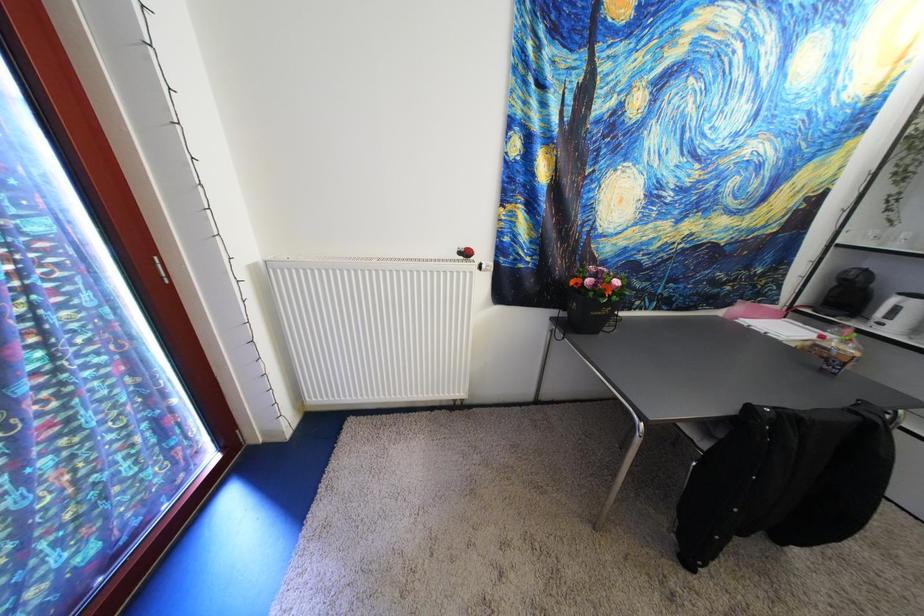
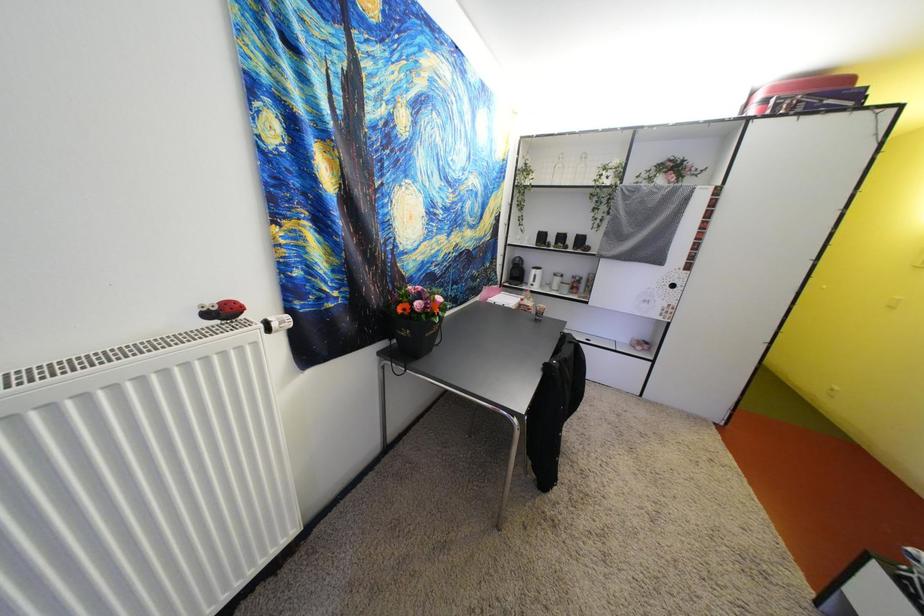
Question: The camera is either moving clockwise (left) or counter-clockwise (right) around the object. The first image is from the beginning of the video and the second image is from the end. Is the camera moving left or right when shooting the video?

Choices:
 (A) Left
 (B) Right

Answer: (A)